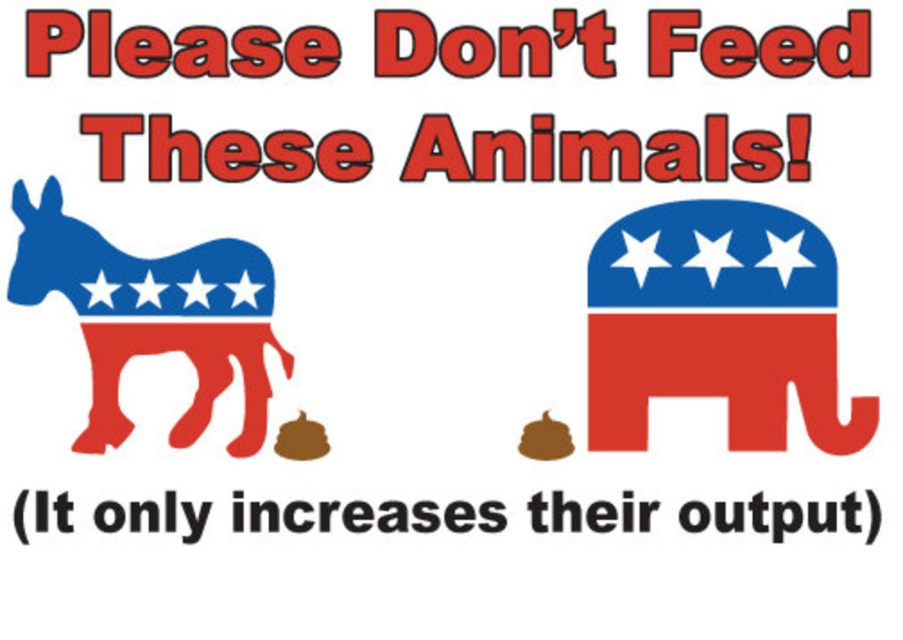
Between point (678, 324) and point (241, 312), which one is positioned behind?

Positioned behind is point (678, 324).

Which of these two, matte plastic elephant at center or blue and white painted donkey at left, stands shorter?

matte plastic elephant at center

Between point (776, 353) and point (254, 419), which one is positioned in front?

Point (254, 419) is more forward.

The image size is (903, 640). Find the location of `matte plastic elephant at center`. matte plastic elephant at center is located at coordinates (717, 324).

Between matte plastic elephant at center and black paper at center, which one has less height?

Standing shorter between the two is black paper at center.

The width and height of the screenshot is (903, 640). What do you see at coordinates (717, 324) in the screenshot? I see `matte plastic elephant at center` at bounding box center [717, 324].

Which is in front, point (727, 397) or point (424, 502)?

Point (424, 502)

Locate an element on the screen. The image size is (903, 640). matte plastic elephant at center is located at coordinates (717, 324).

Does blue and white painted donkey at left appear on the right side of black paper at center?

Incorrect, blue and white painted donkey at left is not on the right side of black paper at center.

Is blue and white painted donkey at left shorter than black paper at center?

No.

Is point (54, 250) farther from viewer compared to point (241, 502)?

Yes.

Identify the location of blue and white painted donkey at left. This screenshot has height=640, width=903. 129,269.